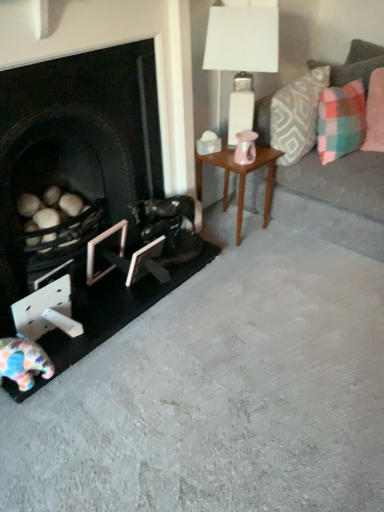
The height and width of the screenshot is (512, 384). Identify the location of black matte fireplace at left. (75, 155).

Locate an element on the screen. plaid fabric pillow at upper right, which is the 3th pillow from right to left is located at coordinates (297, 115).

In order to face fluffy fabric toy at lower left, should I rotate leftwards or rightwards?

To face it directly, rotate left by 23.050 degrees.

What do you see at coordinates (341, 120) in the screenshot? I see `plaid fabric pillow at upper right, acting as the second pillow starting from the left` at bounding box center [341, 120].

Measure the distance between wooden side table at center and camera.

wooden side table at center and camera are 6.71 feet apart.

Where is `black matte fireplace at left`? Image resolution: width=384 pixels, height=512 pixels. black matte fireplace at left is located at coordinates (75, 155).

Is point (21, 286) farther from viewer compared to point (380, 106)?

No, (21, 286) is closer to viewer.

Between black matte fireplace at left and pink fabric pillow at upper right, which is counted as the 1th pillow, starting from the right, which one has larger width?

black matte fireplace at left is wider.

Which object is positioned more to the right, black matte fireplace at left or pink fabric pillow at upper right, which is the 3th pillow from left to right?

From the viewer's perspective, pink fabric pillow at upper right, which is the 3th pillow from left to right, appears more on the right side.

From the image's perspective, is black matte fireplace at left located beneath pink fabric pillow at upper right, which is the 3th pillow from left to right?

Yes.

Which is more to the left, metallic silver picture frame at lower left, the 1th picture frame positioned from the left, or wooden side table at center?

metallic silver picture frame at lower left, the 1th picture frame positioned from the left.

Is metallic silver picture frame at lower left, the 1th picture frame positioned from the left, aimed at wooden side table at center?

No.

From a real-world perspective, is metallic silver picture frame at lower left, arranged as the second picture frame when viewed from the right, physically above wooden side table at center?

No, from a real-world perspective, metallic silver picture frame at lower left, arranged as the second picture frame when viewed from the right, is not on top of wooden side table at center.

Is fluffy fabric toy at lower left next to white matte picture frame at lower center, the 2th picture frame viewed from the left?

There is a gap between fluffy fabric toy at lower left and white matte picture frame at lower center, the 2th picture frame viewed from the left.

Considering the sizes of objects fluffy fabric toy at lower left and white matte picture frame at lower center, the 2th picture frame viewed from the left, in the image provided, who is smaller, fluffy fabric toy at lower left or white matte picture frame at lower center, the 2th picture frame viewed from the left,?

white matte picture frame at lower center, the 2th picture frame viewed from the left, is smaller.

How much distance is there between fluffy fabric toy at lower left and white matte picture frame at lower center, the 2th picture frame viewed from the left?

fluffy fabric toy at lower left is 23.58 inches from white matte picture frame at lower center, the 2th picture frame viewed from the left.

Considering the relative positions of fluffy fabric toy at lower left and white matte picture frame at lower center, which is counted as the 1th picture frame, starting from the right, in the image provided, is fluffy fabric toy at lower left to the left or to the right of white matte picture frame at lower center, which is counted as the 1th picture frame, starting from the right,?

In the image, fluffy fabric toy at lower left appears on the left side of white matte picture frame at lower center, which is counted as the 1th picture frame, starting from the right.

Is white glossy table lamp at upper right facing towards plaid fabric pillow at upper right, the 1th pillow in the left-to-right sequence?

No, white glossy table lamp at upper right is not facing towards plaid fabric pillow at upper right, the 1th pillow in the left-to-right sequence.

Who is bigger, white glossy table lamp at upper right or plaid fabric pillow at upper right, which is the 3th pillow from right to left?

With larger size is white glossy table lamp at upper right.

Considering the relative positions of white glossy table lamp at upper right and plaid fabric pillow at upper right, the 1th pillow in the left-to-right sequence, in the image provided, is white glossy table lamp at upper right to the left or to the right of plaid fabric pillow at upper right, the 1th pillow in the left-to-right sequence,?

white glossy table lamp at upper right is to the left of plaid fabric pillow at upper right, the 1th pillow in the left-to-right sequence.

Which is nearer, (235, 21) or (223, 160)?

Positioned in front is point (235, 21).

Could wooden side table at center be considered to be inside white glossy table lamp at upper right?

No, wooden side table at center is not surrounded by white glossy table lamp at upper right.

Is white glossy table lamp at upper right next to wooden side table at center and touching it?

white glossy table lamp at upper right is not next to wooden side table at center, and they're not touching.

Is white glossy table lamp at upper right at the left side of wooden side table at center?

In fact, white glossy table lamp at upper right is to the right of wooden side table at center.

Between white glossy table lamp at upper right and plaid fabric pillow at upper right, the second pillow from the right, which one appears on the left side from the viewer's perspective?

white glossy table lamp at upper right.

Which is behind, point (220, 37) or point (360, 102)?

The point (360, 102) is behind.

From a real-world perspective, is white glossy table lamp at upper right on plaid fabric pillow at upper right, acting as the second pillow starting from the left?

Yes.

From a real-world perspective, between plaid fabric pillow at upper right, which is the 3th pillow from right to left, and wooden side table at center, who is vertically lower?

From a 3D spatial view, wooden side table at center is below.

Consider the image. Can you confirm if plaid fabric pillow at upper right, which is the 3th pillow from right to left, is positioned to the right of wooden side table at center?

Indeed, plaid fabric pillow at upper right, which is the 3th pillow from right to left, is positioned on the right side of wooden side table at center.

At what (x,y) coordinates should I click in order to perform the action: click on table below the plaid fabric pillow at upper right, the 1th pillow in the left-to-right sequence (from a real-world perspective). Please return your answer as a coordinate pair (x, y). Looking at the image, I should click on (240, 177).

From the black matte fireplace at left, count 3rd pillows backward and point to it. Please provide its 2D coordinates.

[(375, 113)]

Identify the location of the 2nd picture frame to the left of the wooden side table at center, counting from the anchor's position. This screenshot has width=384, height=512. (100, 242).

Based on their spatial positions, is pink fabric pillow at upper right, which is the 3th pillow from left to right, or white matte picture frame at lower center, the 2th picture frame viewed from the left, further from plaid fabric pillow at upper right, the 1th pillow in the left-to-right sequence?

Among the two, white matte picture frame at lower center, the 2th picture frame viewed from the left, is located further to plaid fabric pillow at upper right, the 1th pillow in the left-to-right sequence.

Estimate the real-world distances between objects in this image. Which object is closer to plaid fabric couch at right, plaid fabric pillow at upper right, the second pillow from the right, or shiny black leather swivel chair at center?

Based on the image, plaid fabric pillow at upper right, the second pillow from the right, appears to be nearer to plaid fabric couch at right.

Looking at the image, which one is located further to plaid fabric pillow at upper right, the second pillow from the right, wooden side table at center or fluffy fabric toy at lower left?

fluffy fabric toy at lower left is positioned further to the anchor plaid fabric pillow at upper right, the second pillow from the right.

Looking at the image, which one is located closer to black matte fireplace at left, pink fabric pillow at upper right, which is counted as the 1th pillow, starting from the right, or fluffy fabric toy at lower left?

fluffy fabric toy at lower left lies closer to black matte fireplace at left than the other object.

Looking at the image, which one is located closer to plaid fabric couch at right, shiny black leather swivel chair at center or fluffy fabric toy at lower left?

shiny black leather swivel chair at center is closer to plaid fabric couch at right.

Looking at the image, which one is located closer to metallic silver picture frame at lower left, arranged as the second picture frame when viewed from the right, shiny black leather swivel chair at center or pink fabric pillow at upper right, which is the 3th pillow from left to right?

The object closer to metallic silver picture frame at lower left, arranged as the second picture frame when viewed from the right, is shiny black leather swivel chair at center.

Looking at this image, which object lies nearer to the anchor point metallic silver picture frame at lower left, arranged as the second picture frame when viewed from the right, plaid fabric pillow at upper right, which is the 3th pillow from right to left, or fluffy fabric toy at lower left?

fluffy fabric toy at lower left lies closer to metallic silver picture frame at lower left, arranged as the second picture frame when viewed from the right, than the other object.

Estimate the real-world distances between objects in this image. Which object is further from plaid fabric pillow at upper right, the 1th pillow in the left-to-right sequence, white glossy table lamp at upper right or plaid fabric couch at right?

Among the two, white glossy table lamp at upper right is located further to plaid fabric pillow at upper right, the 1th pillow in the left-to-right sequence.

This screenshot has width=384, height=512. Identify the location of table between fluffy fabric toy at lower left and plaid fabric pillow at upper right, the 1th pillow in the left-to-right sequence, in the horizontal direction. (240, 177).

At what (x,y) coordinates should I click in order to perform the action: click on table between metallic silver picture frame at lower left, arranged as the second picture frame when viewed from the right, and plaid fabric pillow at upper right, the second pillow from the right. Please return your answer as a coordinate pair (x, y). Image resolution: width=384 pixels, height=512 pixels. Looking at the image, I should click on coord(240,177).

The height and width of the screenshot is (512, 384). Find the location of `table lamp located between white matte picture frame at lower center, the 2th picture frame viewed from the left, and plaid fabric couch at right in the left-right direction`. table lamp located between white matte picture frame at lower center, the 2th picture frame viewed from the left, and plaid fabric couch at right in the left-right direction is located at coordinates (243, 37).

The height and width of the screenshot is (512, 384). I want to click on swivel chair between metallic silver picture frame at lower left, arranged as the second picture frame when viewed from the right, and plaid fabric pillow at upper right, the second pillow from the right, in the horizontal direction, so click(170, 226).